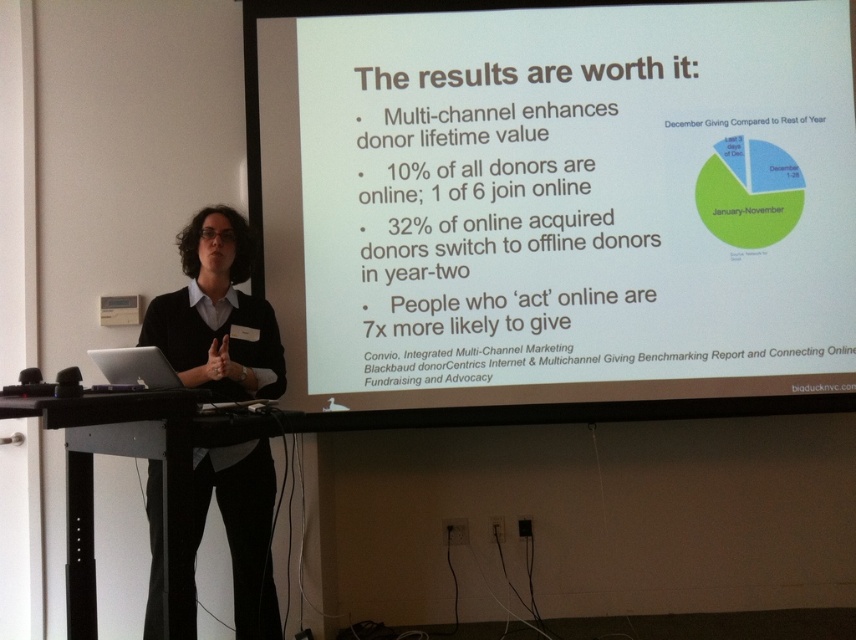
Question: Does white matte projection screen at upper center appear on the right side of silver metallic laptop at lower left?

Choices:
 (A) no
 (B) yes

Answer: (B)

Question: Which of the following is the closest to the observer?

Choices:
 (A) silver metallic laptop at lower left
 (B) white matte projection screen at upper center
 (C) black matte sweater at center

Answer: (A)

Question: Considering the real-world distances, which object is closest to the white matte projection screen at upper center?

Choices:
 (A) silver metallic laptop at lower left
 (B) black matte sweater at center

Answer: (B)

Question: In this image, where is white matte projection screen at upper center located relative to black matte sweater at center?

Choices:
 (A) above
 (B) below

Answer: (A)

Question: Does white matte projection screen at upper center appear under black matte sweater at center?

Choices:
 (A) no
 (B) yes

Answer: (A)

Question: Which object is farther from the camera taking this photo?

Choices:
 (A) silver metallic laptop at lower left
 (B) black matte sweater at center
 (C) white matte projection screen at upper center

Answer: (C)